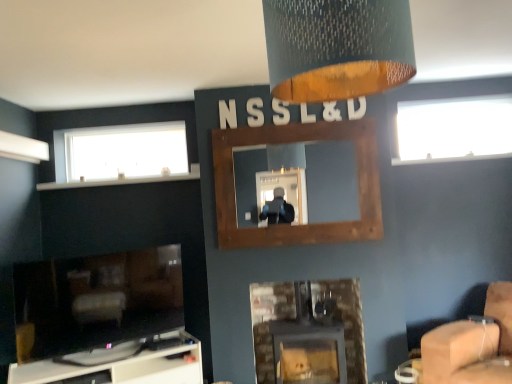
Find the location of a particular element. Image resolution: width=512 pixels, height=384 pixels. free location above transparent glass window at upper right, the first window from the right (from a real-world perspective) is located at coordinates (454, 107).